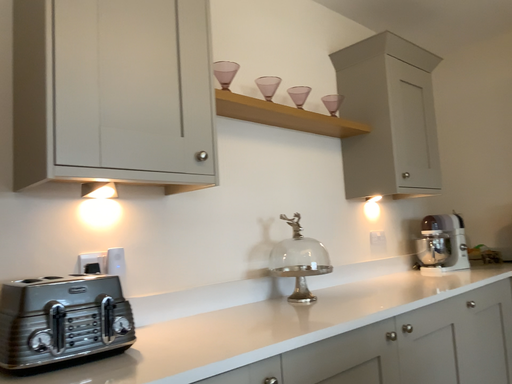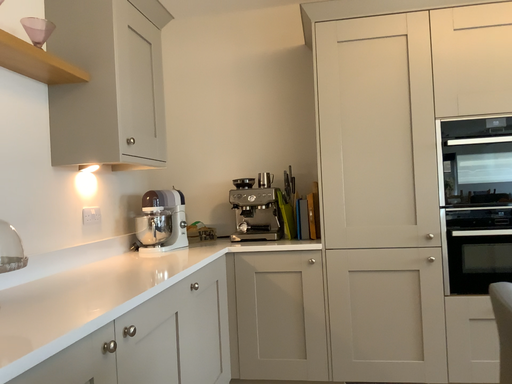
Question: Which way did the camera rotate in the video?

Choices:
 (A) rotated right
 (B) rotated left

Answer: (A)